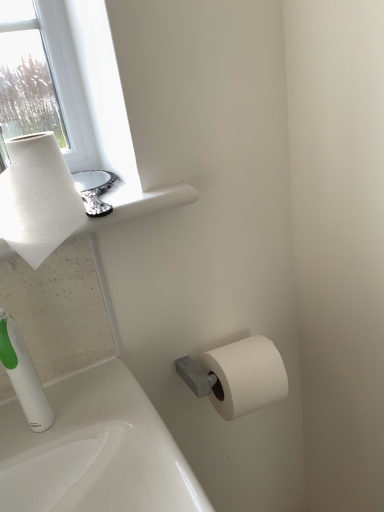
Question: Does white plastic soap dispenser at lower left have a greater height compared to white textured paper towel at upper left?

Choices:
 (A) no
 (B) yes

Answer: (B)

Question: From a real-world perspective, is white plastic soap dispenser at lower left located beneath white textured paper towel at upper left?

Choices:
 (A) no
 (B) yes

Answer: (B)

Question: Can you confirm if white plastic soap dispenser at lower left is positioned to the right of white textured paper towel at upper left?

Choices:
 (A) no
 (B) yes

Answer: (A)

Question: Is white plastic soap dispenser at lower left closer to camera compared to white textured paper towel at upper left?

Choices:
 (A) yes
 (B) no

Answer: (B)

Question: Does white plastic soap dispenser at lower left have a lesser height compared to white textured paper towel at upper left?

Choices:
 (A) yes
 (B) no

Answer: (B)

Question: Are white plastic soap dispenser at lower left and white textured paper towel at upper left making contact?

Choices:
 (A) yes
 (B) no

Answer: (B)

Question: Does white textured paper towel at upper left have a greater height compared to white matte paper towel at upper left?

Choices:
 (A) yes
 (B) no

Answer: (A)

Question: From the image's perspective, would you say white textured paper towel at upper left is shown under white matte paper towel at upper left?

Choices:
 (A) no
 (B) yes

Answer: (B)

Question: From the image's perspective, is white textured paper towel at upper left above white matte paper towel at upper left?

Choices:
 (A) yes
 (B) no

Answer: (B)

Question: Considering the relative sizes of white textured paper towel at upper left and white matte paper towel at upper left in the image provided, is white textured paper towel at upper left shorter than white matte paper towel at upper left?

Choices:
 (A) yes
 (B) no

Answer: (B)

Question: From a real-world perspective, is white textured paper towel at upper left on top of white matte paper towel at upper left?

Choices:
 (A) no
 (B) yes

Answer: (B)

Question: Is white matte paper towel at upper left completely or partially inside white textured paper towel at upper left?

Choices:
 (A) yes
 (B) no

Answer: (B)

Question: From the image's perspective, is white matte paper towel at upper left over white textured paper towel at upper left?

Choices:
 (A) no
 (B) yes

Answer: (B)